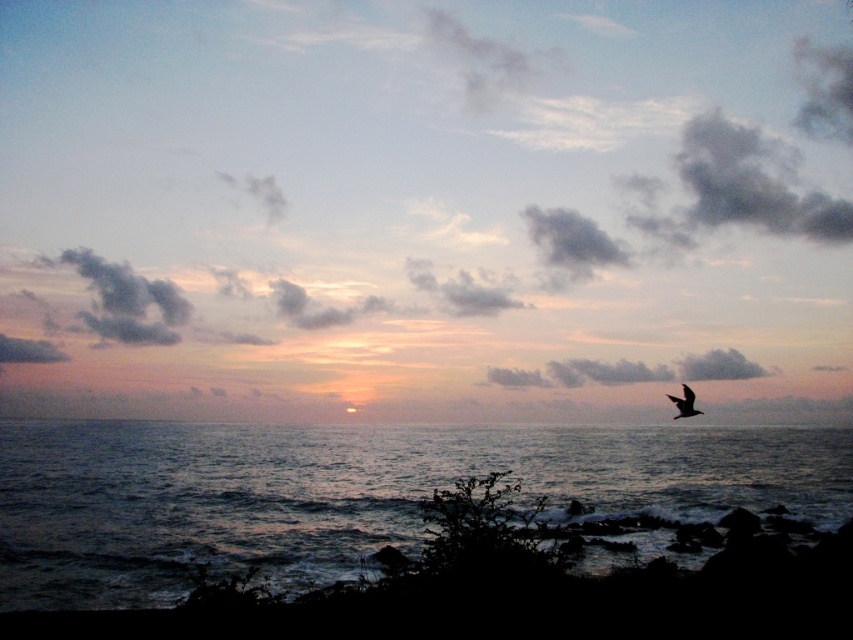
Question: Estimate the real-world distances between objects in this image. Which object is closer to the dark gray cloud at upper center?

Choices:
 (A) dark blue water at lower center
 (B) silvery metallic bird at right

Answer: (A)

Question: Which point is closer to the camera?

Choices:
 (A) gray fluffy cloud at center
 (B) dark blue water at lower center

Answer: (B)

Question: Which point is closer to the camera?

Choices:
 (A) dark blue water at lower center
 (B) silvery metallic bird at right

Answer: (A)

Question: Does dark gray cloud at upper center appear over silvery metallic bird at right?

Choices:
 (A) yes
 (B) no

Answer: (A)

Question: Where is dark gray cloud at upper center located in relation to dark blue water at lower center in the image?

Choices:
 (A) right
 (B) left

Answer: (A)

Question: Can you confirm if dark blue water at lower center is positioned to the left of silvery metallic bird at right?

Choices:
 (A) no
 (B) yes

Answer: (B)